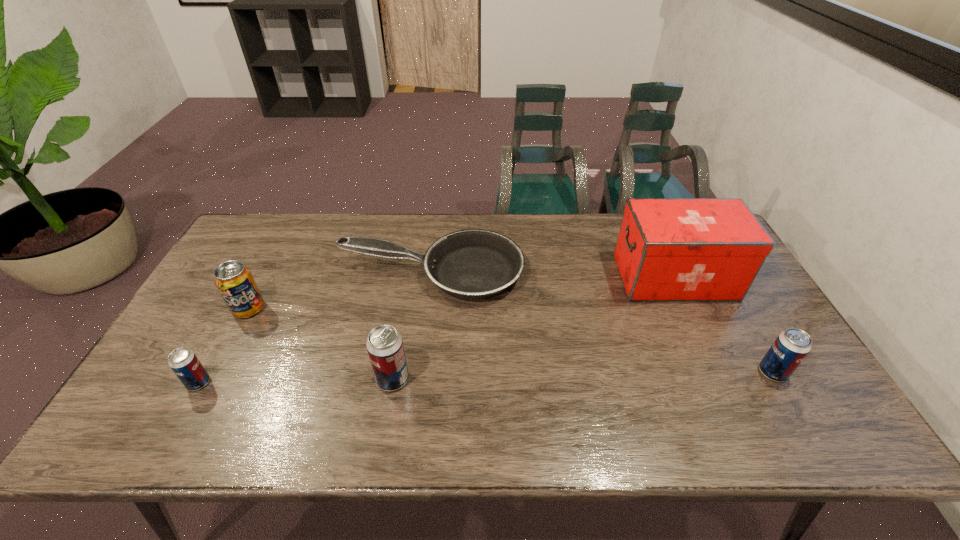
Image resolution: width=960 pixels, height=540 pixels. In order to click on the fifth tallest object in this screenshot , I will do `click(184, 363)`.

Where is `the shortest beer can`? This screenshot has width=960, height=540. the shortest beer can is located at coordinates (184, 363).

Identify the location of the second beer can from left to right. (385, 348).

Locate an element on the screen. This screenshot has width=960, height=540. the second shortest beer can is located at coordinates (791, 346).

Find the location of a particular element. Image resolution: width=960 pixels, height=540 pixels. frying pan is located at coordinates (473, 263).

You are a GUI agent. You are given a task and a screenshot of the screen. Output one action in this format:
    pyautogui.click(x=<x>, y=<y>)
    Task: Click on the tallest object
    This screenshot has width=960, height=540.
    Given the screenshot: What is the action you would take?
    pyautogui.click(x=668, y=249)

Find the location of a particular element. soda can is located at coordinates (235, 282).

You are a GUI agent. You are given a task and a screenshot of the screen. Output one action in this format:
    pyautogui.click(x=<x>, y=<y>)
    Task: Click on the free location located 0.130m on the right of the fifth tallest object
    Image resolution: width=960 pixels, height=540 pixels.
    Given the screenshot: What is the action you would take?
    pyautogui.click(x=263, y=383)

Find the location of a particular element. This screenshot has width=960, height=540. free space located on the left of the tallest beer can is located at coordinates (222, 379).

I want to click on free location located 0.210m on the left of the second tallest beer can, so click(x=675, y=372).